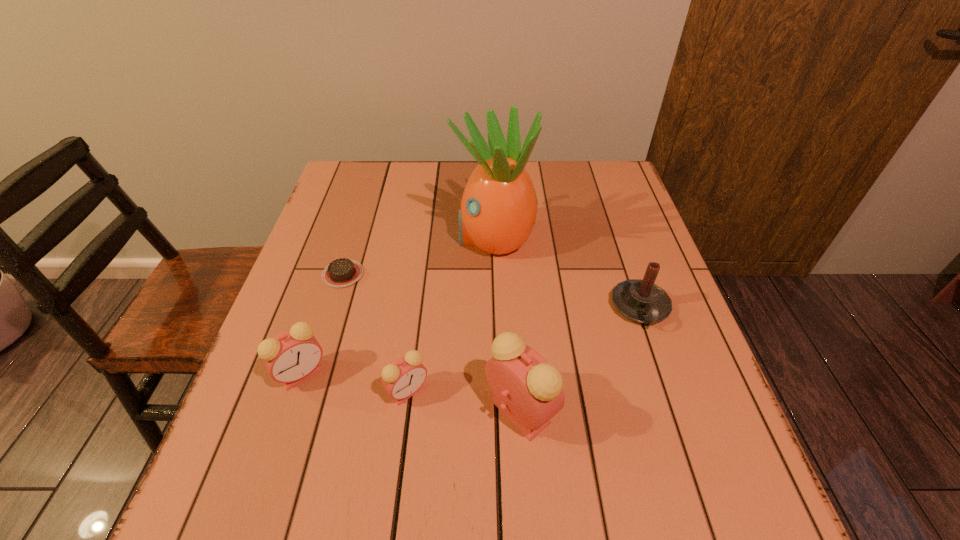
Identify the location of vacant space situated on the face of the rightmost alarm clock. (588, 410).

Where is `vacant space located 0.290m on the right of the shortest object`? Image resolution: width=960 pixels, height=540 pixels. vacant space located 0.290m on the right of the shortest object is located at coordinates (482, 274).

Locate an element on the screen. free location located at the entrance of the pineapple is located at coordinates (363, 237).

Locate an element on the screen. vacant space located 0.220m at the entrance of the pineapple is located at coordinates 371,237.

This screenshot has height=540, width=960. Find the location of `free location located 0.110m at the entrance of the pineapple`. free location located 0.110m at the entrance of the pineapple is located at coordinates (412, 237).

Locate an element on the screen. vacant space situated on the side of the rightmost object with the handle loop is located at coordinates (660, 366).

Where is `object that is positioned at the near edge`? object that is positioned at the near edge is located at coordinates click(x=527, y=390).

This screenshot has width=960, height=540. Find the location of `alarm clock present at the left edge`. alarm clock present at the left edge is located at coordinates (292, 356).

You are a GUI agent. You are given a task and a screenshot of the screen. Output one action in this format:
    pyautogui.click(x=<x>, y=<y>)
    Task: Click on the chocolate cake situated at the left edge
    This screenshot has height=540, width=960.
    Given the screenshot: What is the action you would take?
    pyautogui.click(x=341, y=272)

Where is `object situated at the right edge`? This screenshot has width=960, height=540. object situated at the right edge is located at coordinates (642, 301).